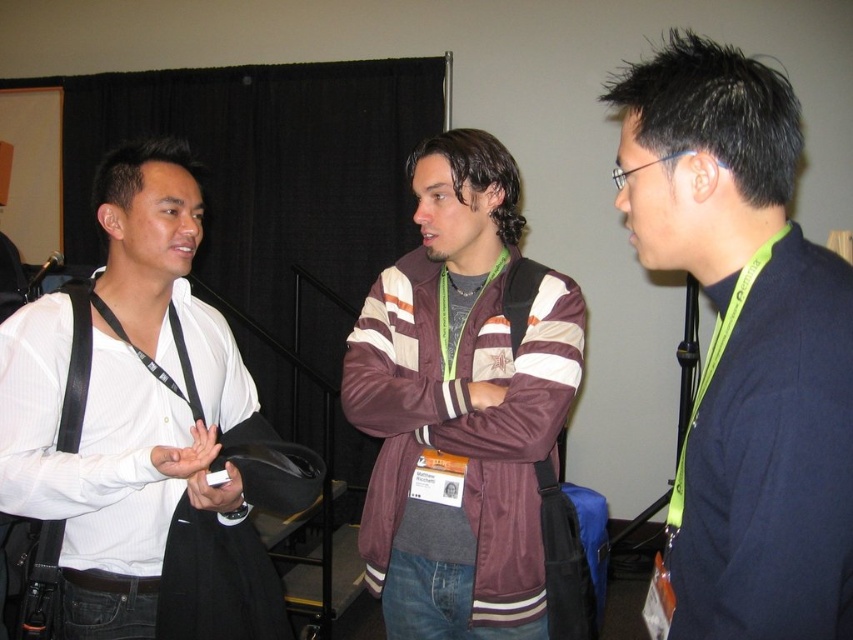
Question: Is dark blue sweater at center positioned in front of maroon fabric jacket at center?

Choices:
 (A) no
 (B) yes

Answer: (B)

Question: Does dark blue sweater at center appear over white shirt at left?

Choices:
 (A) yes
 (B) no

Answer: (A)

Question: Which point appears closest to the camera in this image?

Choices:
 (A) (820, 449)
 (B) (181, 193)

Answer: (A)

Question: Which of the following is the closest to the observer?

Choices:
 (A) white shirt at left
 (B) dark blue sweater at center

Answer: (B)

Question: Which point is farther to the camera?

Choices:
 (A) dark blue sweater at center
 (B) maroon fabric jacket at center

Answer: (B)

Question: Is dark blue sweater at center positioned before maroon fabric jacket at center?

Choices:
 (A) yes
 (B) no

Answer: (A)